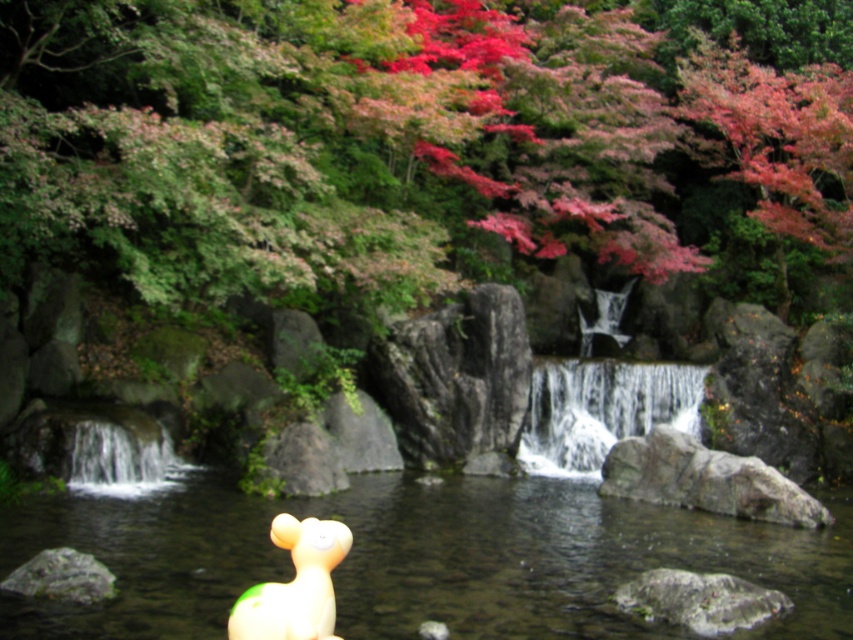
You are a photographer adjusting your camera to focus on two points in the scene. The first point is at coordinates point (90, 474) and the second is at point (67, 586). Which point should you focus on first if you want to ensure the closest object is sharp?

Point (90, 474) is further to the camera than point (67, 586), so you should focus on point (90, 474) first to capture the closest object sharply.

You are a photographer trying to capture the waterfall scene. You want to ensure the white frothy water at center and the gray rough rock at center are both clearly visible in your shot. Given their sizes, which object will occupy more space in the photo?

The white frothy water at center will occupy more space in the photo because its width is larger than that of the gray rough rock at center.